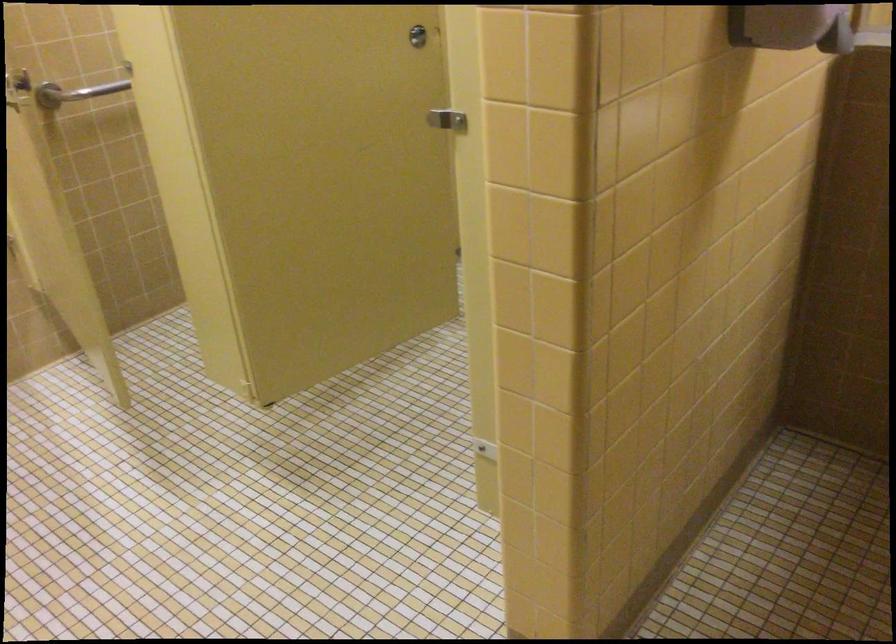
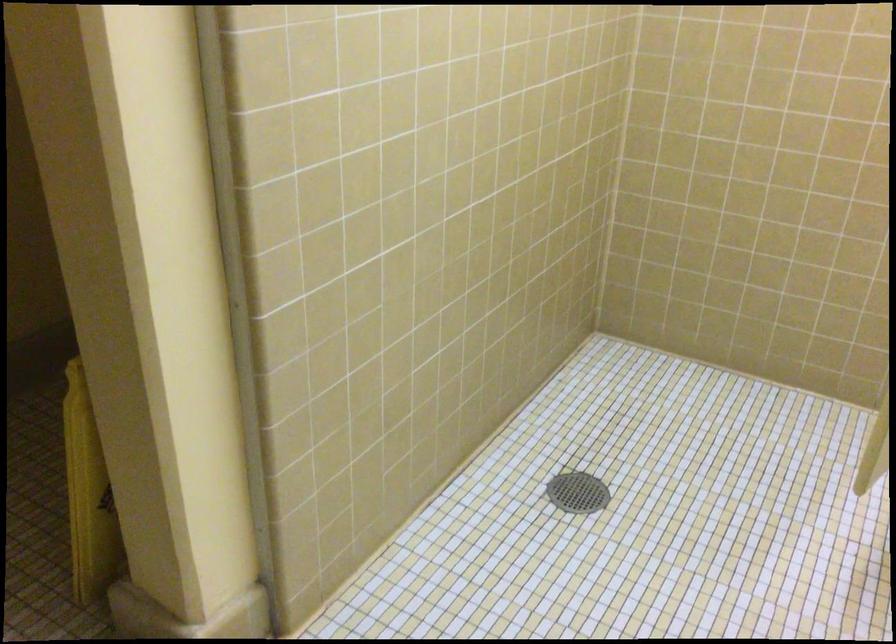
The first image is from the beginning of the video and the second image is from the end. How did the camera likely rotate when shooting the video?

The camera rotated toward left-down.